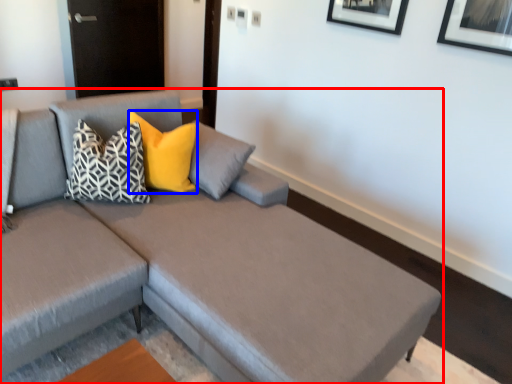
Question: Among these objects, which one is nearest to the camera, studio couch (highlighted by a red box) or pillow (highlighted by a blue box)?

Choices:
 (A) studio couch
 (B) pillow

Answer: (A)